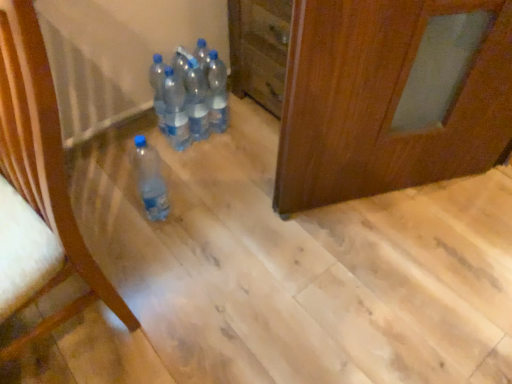
The width and height of the screenshot is (512, 384). In order to click on free space in front of transparent plastic bottles at center, the 5th bottle when ordered from right to left in this screenshot , I will do `click(161, 165)`.